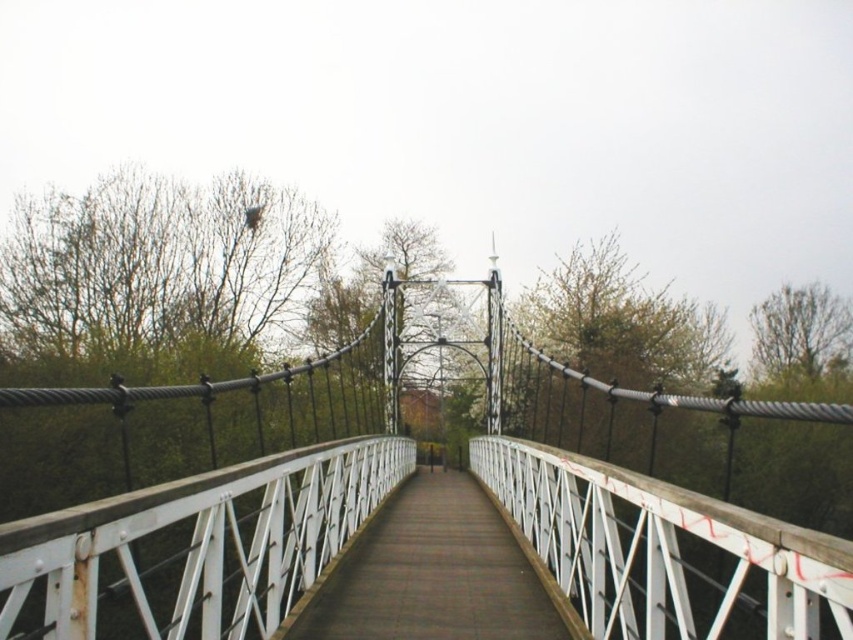
Question: Does white metal suspension bridge at center lie behind white metal bridge at center?

Choices:
 (A) yes
 (B) no

Answer: (B)

Question: Is white metal suspension bridge at center behind white metal bridge at center?

Choices:
 (A) no
 (B) yes

Answer: (A)

Question: Can you confirm if white metal suspension bridge at center is wider than white metal bridge at center?

Choices:
 (A) no
 (B) yes

Answer: (B)